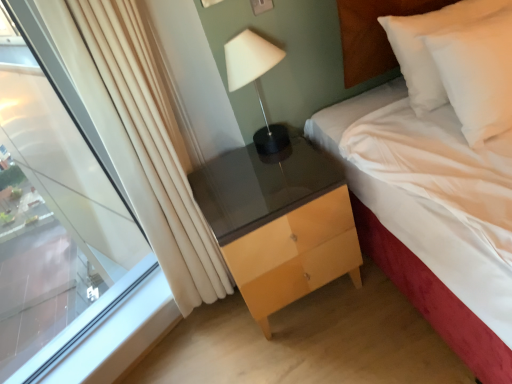
The image size is (512, 384). What are the coordinates of `space that is in front of matte black lamp at upper center` in the screenshot? It's located at (280, 172).